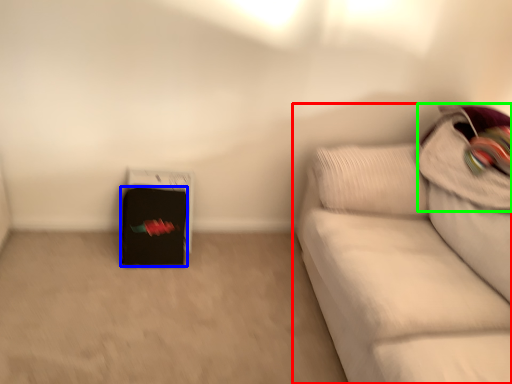
Question: Estimate the real-world distances between objects in this image. Which object is closer to studio couch (highlighted by a red box), luggage (highlighted by a blue box) or pillow (highlighted by a green box)?

Choices:
 (A) luggage
 (B) pillow

Answer: (B)